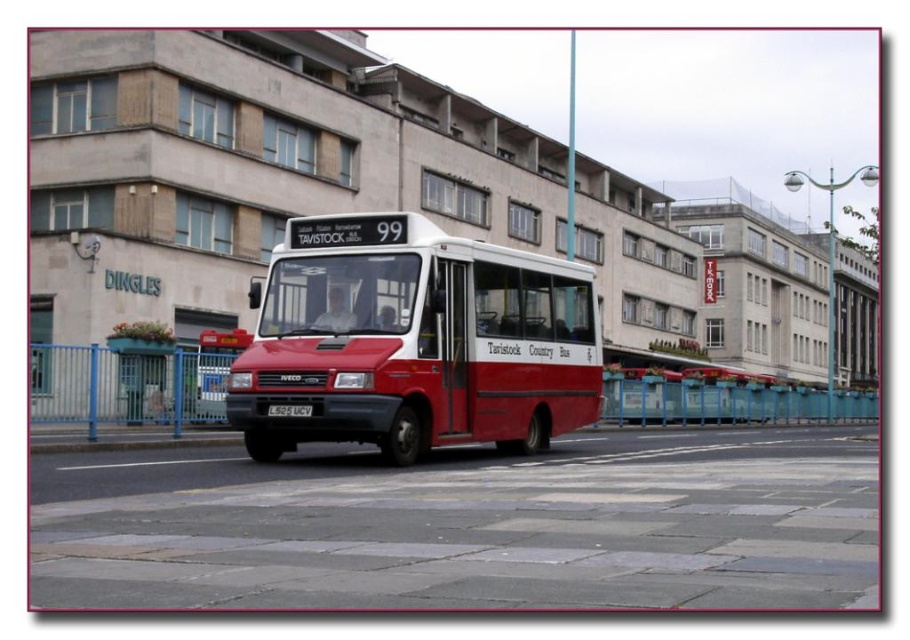
Question: Which point appears closest to the camera in this image?

Choices:
 (A) (285, 417)
 (B) (405, 296)

Answer: (A)

Question: Is matte red bus at center above black plastic license plate at center?

Choices:
 (A) yes
 (B) no

Answer: (A)

Question: Which point is farther to the camera?

Choices:
 (A) black plastic license plate at center
 (B) matte red bus at center

Answer: (A)

Question: In this image, where is matte red bus at center located relative to black plastic license plate at center?

Choices:
 (A) below
 (B) above

Answer: (B)

Question: Among these objects, which one is nearest to the camera?

Choices:
 (A) black plastic license plate at center
 (B) matte red bus at center

Answer: (B)

Question: Can you confirm if matte red bus at center is thinner than black plastic license plate at center?

Choices:
 (A) no
 (B) yes

Answer: (A)